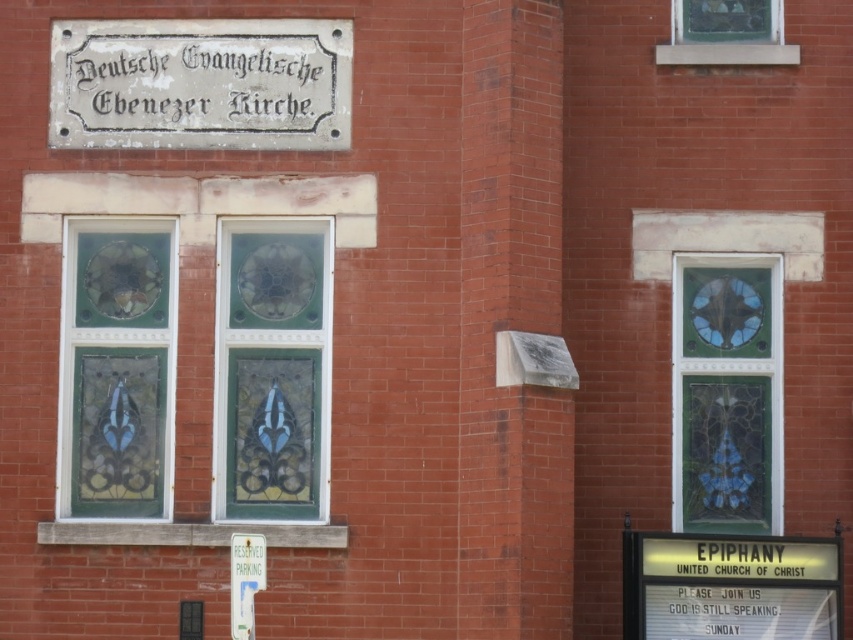
Question: Is white stone sign at upper center positioned before stained glass window at center left?

Choices:
 (A) no
 (B) yes

Answer: (B)

Question: Can you confirm if white stone sign at upper center is wider than stained glass window at right?

Choices:
 (A) yes
 (B) no

Answer: (A)

Question: Which object is farther from the camera taking this photo?

Choices:
 (A) white stone sign at upper center
 (B) stained glass window at upper right
 (C) stained glass window at center left

Answer: (B)

Question: Which of these objects is positioned farthest from the stained glass window at center?

Choices:
 (A) stained glass window at right
 (B) stained glass window at center left
 (C) white stone sign at upper center

Answer: (A)

Question: Can you confirm if white stone sign at upper center is thinner than stained glass window at upper right?

Choices:
 (A) no
 (B) yes

Answer: (B)

Question: Which of the following is the farthest from the observer?

Choices:
 (A) stained glass window at center
 (B) stained glass window at center left

Answer: (B)